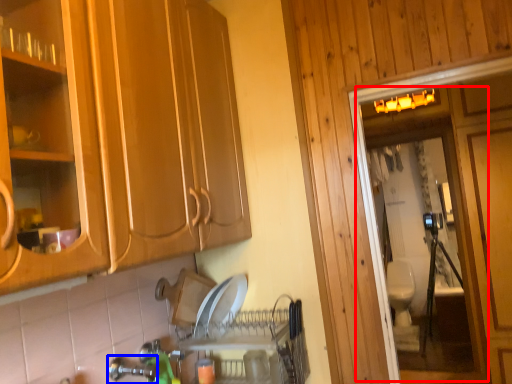
Question: Which object is further to the camera taking this photo, screen door (highlighted by a red box) or faucet (highlighted by a blue box)?

Choices:
 (A) screen door
 (B) faucet

Answer: (A)